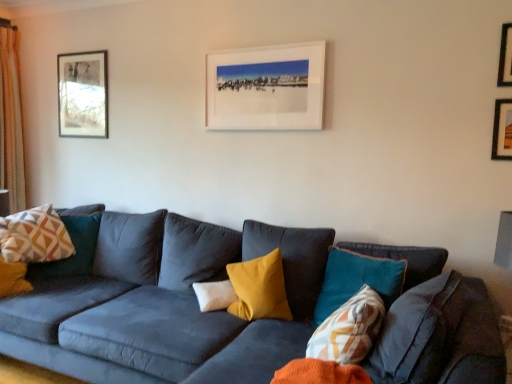
Identify the location of vacant area on top of white matte picture frame at upper center, which is the 3th picture frame from front to back (from a real-world perspective). (264, 47).